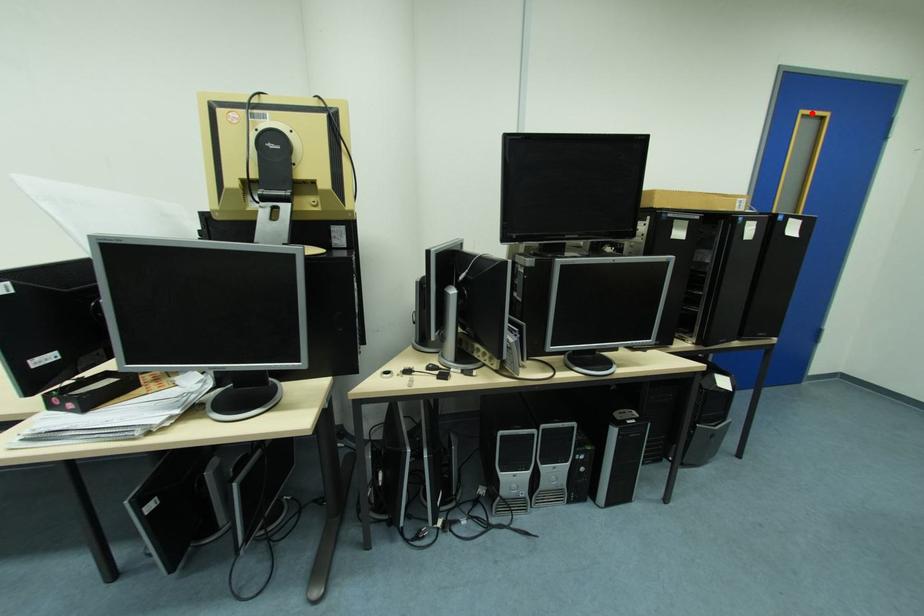
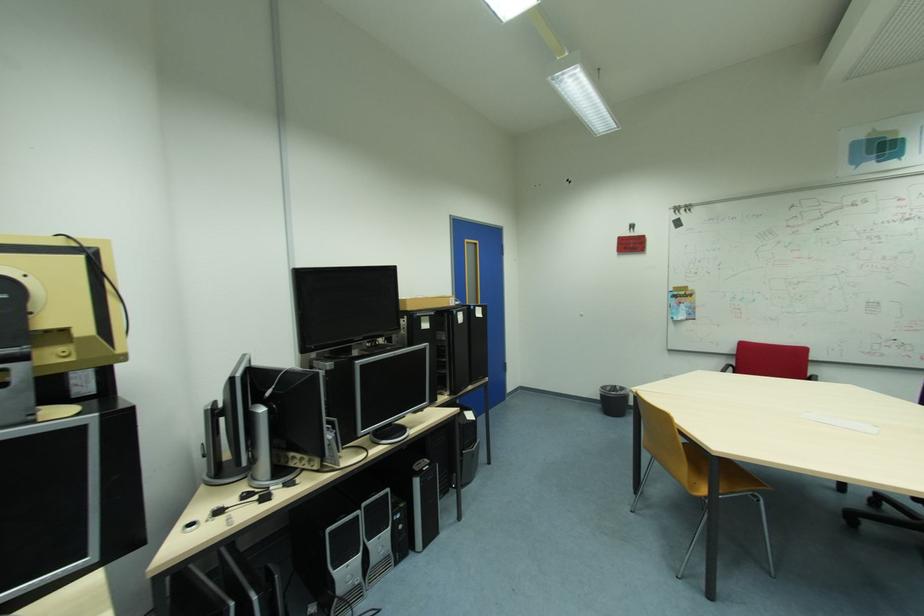
Find the pixel in the second image that matches the highlighted location in the first image.

(473, 241)